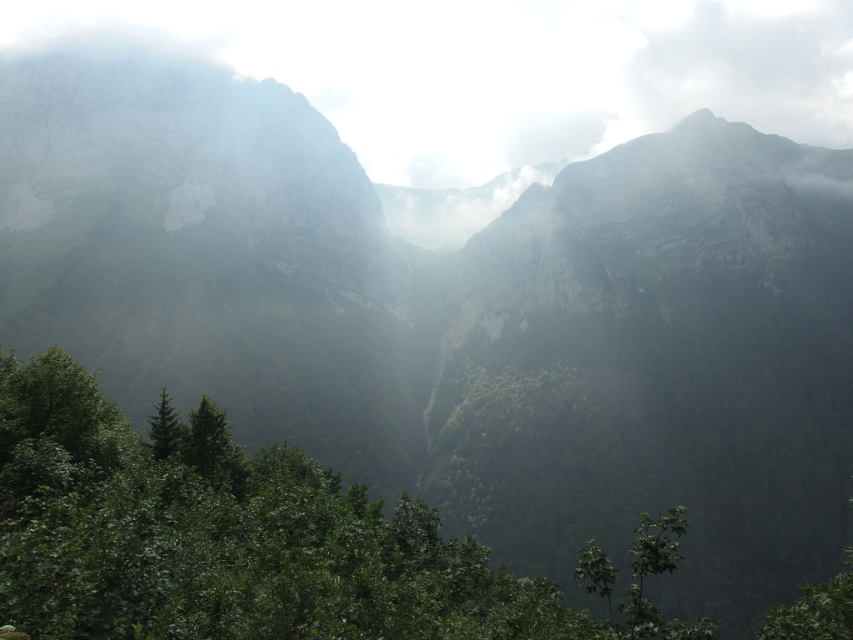
You are standing at the point marked by coordinates (234, 541) in the mountainous landscape. What type of vegetation are you surrounded by?

The point at coordinates (234, 541) is on a green leafy tree at center, so you are surrounded by green leafy trees.

You are hiking in the mountain and want to reach the point marked as point (154, 429). However, there is an obstacle at point (180, 433). Can you safely walk around the obstacle to reach your destination?

Point (180, 433) is in front of point (154, 429). Therefore, you cannot safely walk around the obstacle at point (180, 433) to reach your destination because the obstacle is blocking the path directly in front of your destination.